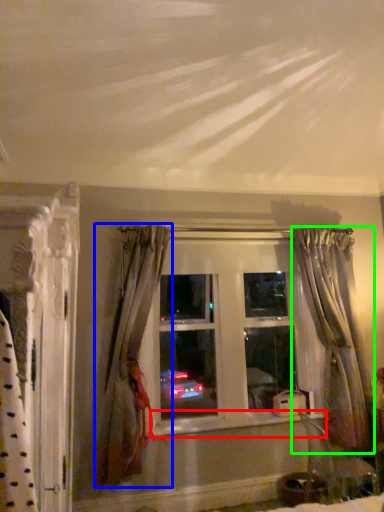
Question: Which object is the closest to the window sill (highlighted by a red box)? Choose among these: curtain (highlighted by a blue box) or curtain (highlighted by a green box).

Choices:
 (A) curtain
 (B) curtain

Answer: (A)